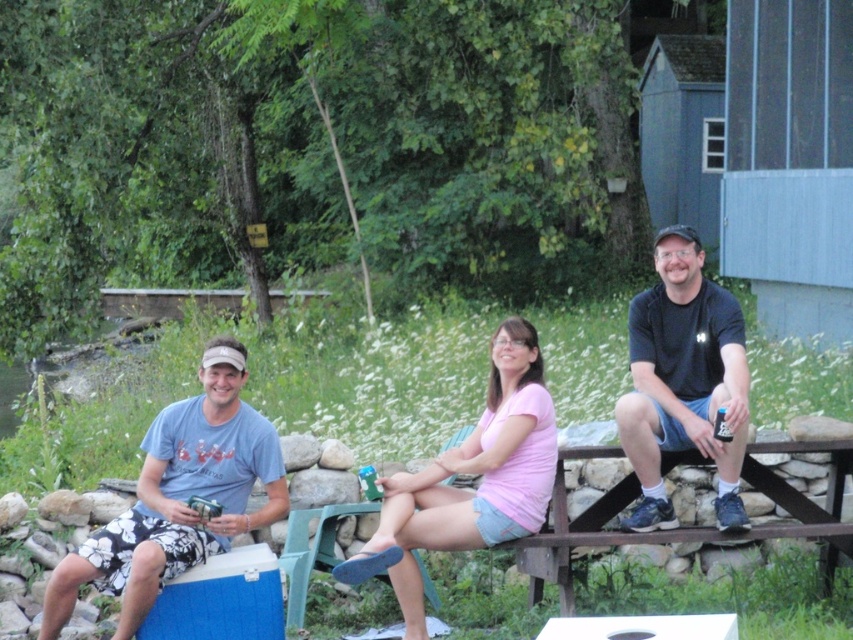
You are standing in the park and see two people sitting at a picnic table. The man in the blue cotton shirt at left is holding a cooler, and the woman in the black matte shirt at center is looking at her phone. Which person is positioned closer to you?

The blue cotton shirt at left is closer to the viewer than the black matte shirt at center, so the man in the blue cotton shirt at left is closer to you.

You are a photographer trying to capture a group photo of the two people at the picnic table. You want to ensure both the black matte shirt at center and the pink cotton shirt at center are clearly visible in the photo. Based on their positions, which shirt might be partially hidden and why?

The pink cotton shirt at center might be partially hidden because it is positioned behind the black matte shirt at center, which could block part of the view of the pink cotton shirt.